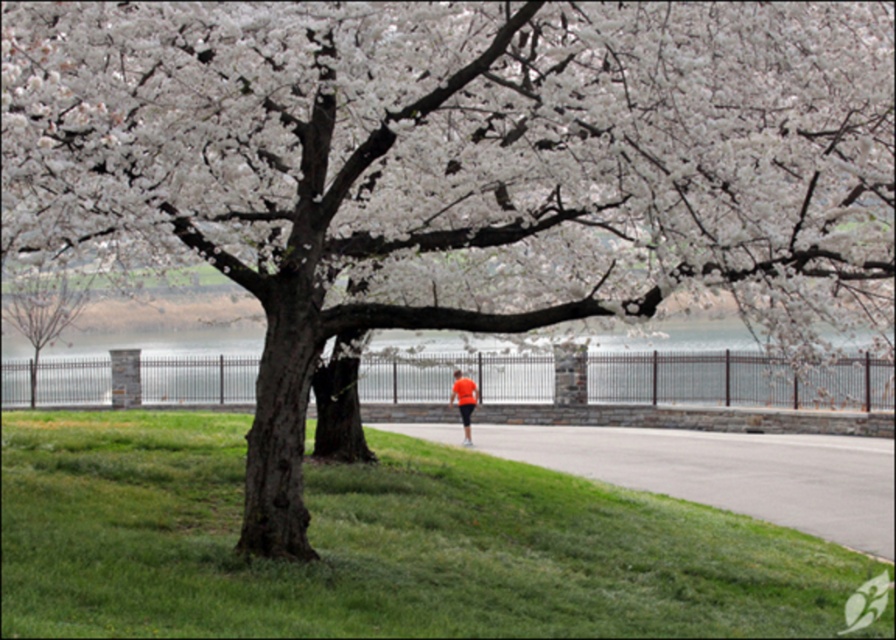
Consider the image. You are standing at the lower center of the scene. You want to walk towards the orange fabric shorts at center. Which direction should you move relative to the gray asphalt pavement at lower center?

Since the gray asphalt pavement at lower center is in front of orange fabric shorts at center, you should move away from the gray asphalt pavement at lower center to reach the orange fabric shorts at center.

You are standing at the point labeled point (x=468, y=416) and want to walk to the point labeled point (x=889, y=540). According to the scene, which direction should you move to reach your destination?

To reach point (x=889, y=540) from point (x=468, y=416), you should move forward because point (x=889, y=540) is in front of point (x=468, y=416).

You are planning to install a bench on the gray asphalt pavement at lower center. The bench requires a minimum of 40 feet of space between it and the smooth bark tree at left to comply with safety regulations. Based on the scene description, will the current distance meet the requirement?

The distance between the gray asphalt pavement at lower center and the smooth bark tree at left is 39.57 feet, which is slightly less than the required 40 feet. Therefore, the current distance does not meet the safety regulation requirement.